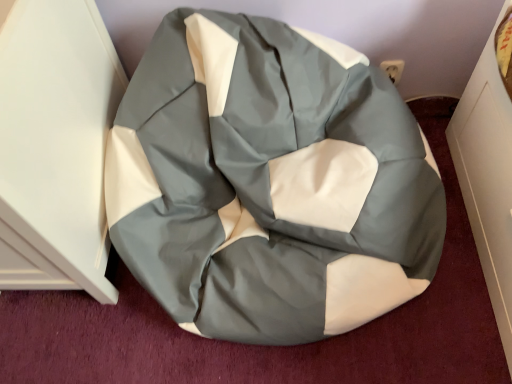
What do you see at coordinates (269, 182) in the screenshot?
I see `matte fabric bean bag at center` at bounding box center [269, 182].

Identify the location of matte fabric bean bag at center. (269, 182).

Identify the location of matte fabric bean bag at center. This screenshot has height=384, width=512. (269, 182).